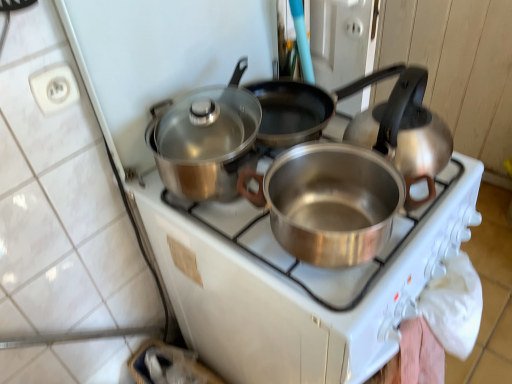
Question: Is matte white stove at center bigger or smaller than silver metallic pot at center?

Choices:
 (A) big
 (B) small

Answer: (A)

Question: From a real-world perspective, is matte white stove at center above or below silver metallic pot at center?

Choices:
 (A) above
 (B) below

Answer: (B)

Question: Which object is the closest to the matte white stove at center?

Choices:
 (A) shiny metallic pot at center
 (B) satin silver kettle at right
 (C) silver metallic pot at center

Answer: (A)

Question: Which is nearer to the satin silver kettle at right?

Choices:
 (A) shiny metallic pot at center
 (B) silver metallic pot at center
 (C) matte white stove at center

Answer: (B)